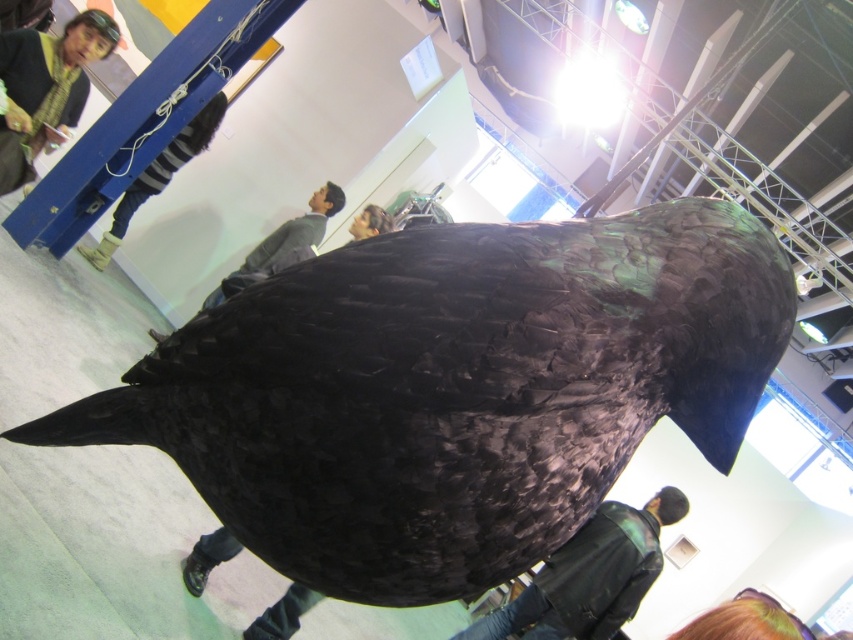
Is shiny black bird at center taller than yellow rubber boot at upper left?

No.

Between shiny black bird at center and yellow rubber boot at upper left, which one is positioned lower?

shiny black bird at center

Does point (527, 458) lie in front of point (200, 147)?

Yes, point (527, 458) is closer to viewer.

Locate an element on the screen. shiny black bird at center is located at coordinates (453, 388).

Between green textured sweater at upper left and matte black bird at upper center, which one has more height?

green textured sweater at upper left is taller.

Looking at this image, is green textured sweater at upper left to the right of matte black bird at upper center from the viewer's perspective?

No, green textured sweater at upper left is not to the right of matte black bird at upper center.

In the scene shown: Measure the distance between green textured sweater at upper left and camera.

The distance of green textured sweater at upper left from camera is 3.78 meters.

Locate an element on the screen. This screenshot has height=640, width=853. green textured sweater at upper left is located at coordinates (51, 76).

Is dark gray fabric pants at center closer to the viewer compared to matte black bird at upper center?

Yes, it is.

Describe the element at coordinates (282, 244) in the screenshot. I see `dark gray fabric pants at center` at that location.

Identify the location of dark gray fabric pants at center. (282, 244).